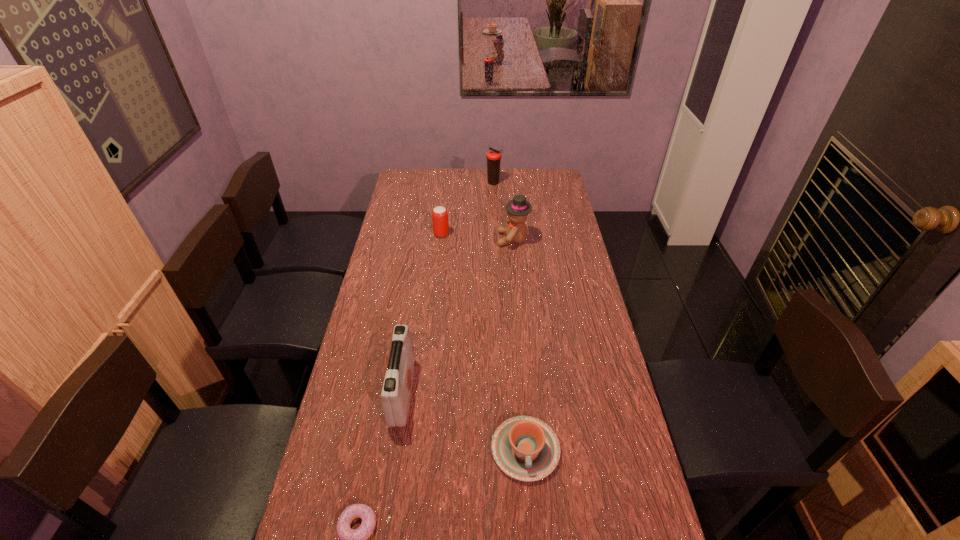
Find the location of a particular element. This screenshot has height=540, width=960. free spot between the farthest object and the second shortest object is located at coordinates (510, 316).

The image size is (960, 540). In order to click on vacant region between the thermos bottle and the fifth tallest object in this screenshot , I will do pyautogui.click(x=510, y=316).

This screenshot has width=960, height=540. I want to click on vacant point located between the thermos bottle and the fifth tallest object, so click(510, 316).

Image resolution: width=960 pixels, height=540 pixels. Find the location of `free space between the rag_doll and the first-aid kit`. free space between the rag_doll and the first-aid kit is located at coordinates (458, 316).

The height and width of the screenshot is (540, 960). I want to click on free space that is in between the rag_doll and the beer can, so click(x=477, y=237).

Locate an element on the screen. The image size is (960, 540). empty space that is in between the rag_doll and the farthest object is located at coordinates (503, 211).

Locate an element on the screen. This screenshot has width=960, height=540. unoccupied area between the fourth tallest object and the rag_doll is located at coordinates (477, 237).

Locate which object ranks third in proximity to the chinaware. Please provide its 2D coordinates. Your answer should be formatted as a tuple, i.e. [(x, y)], where the tuple contains the x and y coordinates of a point satisfying the conditions above.

[(518, 209)]

This screenshot has height=540, width=960. I want to click on object that stands as the fifth closest to the doughnut, so coord(493,157).

You are a GUI agent. You are given a task and a screenshot of the screen. Output one action in this format:
    pyautogui.click(x=<x>, y=<y>)
    Task: Click on the vacant space that satisfies the following two spatial constraints: 1. on the front-facing side of the rag_doll; 2. on the handle side of the second shortest object
    Image resolution: width=960 pixels, height=540 pixels.
    Given the screenshot: What is the action you would take?
    pyautogui.click(x=532, y=450)